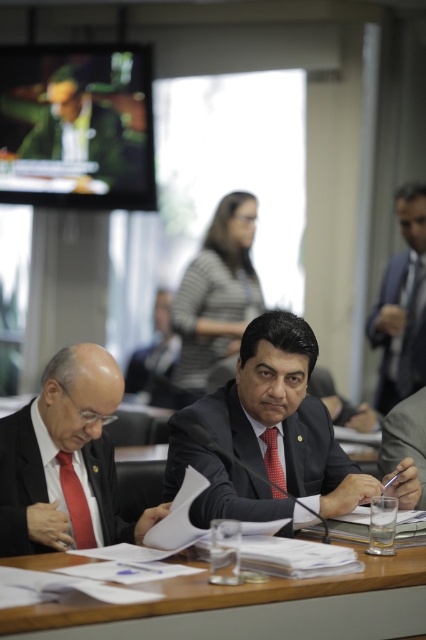
Can you confirm if matte black suit at center is shorter than satin blue suit at right?

Yes, matte black suit at center is shorter than satin blue suit at right.

Which is behind, point (291, 486) or point (385, 342)?

Point (385, 342)

Image resolution: width=426 pixels, height=640 pixels. I want to click on matte black suit at center, so click(x=221, y=461).

Which is more to the left, green fabric jacket at upper left or matte red tie at right?

Positioned to the left is green fabric jacket at upper left.

Does green fabric jacket at upper left lie behind matte red tie at right?

Yes, green fabric jacket at upper left is further from the viewer.

Locate an element on the screen. Image resolution: width=426 pixels, height=640 pixels. green fabric jacket at upper left is located at coordinates (71, 132).

This screenshot has width=426, height=640. In order to click on green fabric jacket at upper left in this screenshot , I will do `click(71, 132)`.

From the picture: Can you confirm if satin blue suit at right is bigger than matte red tie at right?

Yes.

Identify the location of satin blue suit at right. This screenshot has height=640, width=426. (402, 305).